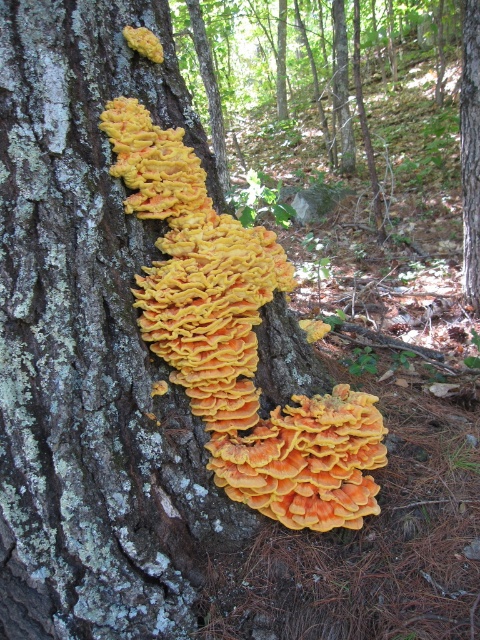
In the scene shown: You are a nature photographer trying to capture both the orange soft coral at center and the smooth bark tree trunk at center in a single frame. Based on their sizes, which object should you focus on first to ensure both fit in the shot?

The orange soft coral at center is larger than the smooth bark tree trunk at center, so you should focus on the orange soft coral at center first to accommodate its size in the frame.

Looking at this image, you are a hiker who has stumbled upon this forest scene. You notice an orange soft coral at center. Based on its coordinates, is it located closer to the top or bottom of the image?

The orange soft coral at center is located at coordinates point [237,340]. Since the y coordinate is 0.494, which is just below the halfway point of the image, it is closer to the bottom of the image.

You are a hiker who wants to take a photo of the orange soft coral at center and the smooth bark tree trunk at center. Which object is closer to the camera? Please explain based on their positions.

The orange soft coral at center is positioned under the smooth bark tree trunk at center, meaning the smooth bark tree trunk at center is closer to the camera.